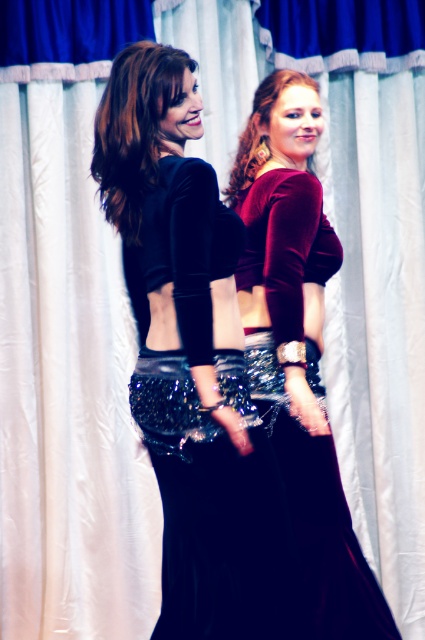
Question: Is velvet black dress at center thinner than velvet maroon crop top at center?

Choices:
 (A) no
 (B) yes

Answer: (A)

Question: Where is velvet black dress at center located in relation to velvet maroon crop top at center in the image?

Choices:
 (A) left
 (B) right

Answer: (A)

Question: Where is velvet black dress at center located in relation to velvet maroon crop top at center in the image?

Choices:
 (A) right
 (B) left

Answer: (B)